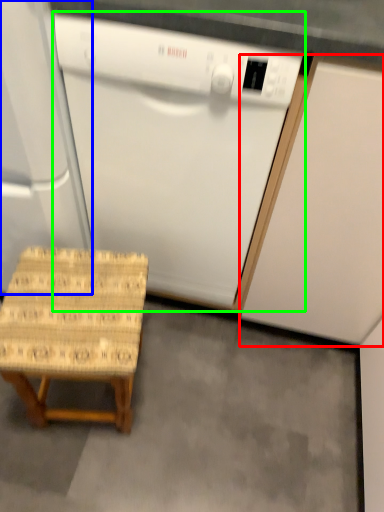
Question: Which object is positioned farthest from cabinetry (highlighted by a red box)? Select from appliance (highlighted by a blue box) and home appliance (highlighted by a green box).

Choices:
 (A) appliance
 (B) home appliance

Answer: (A)